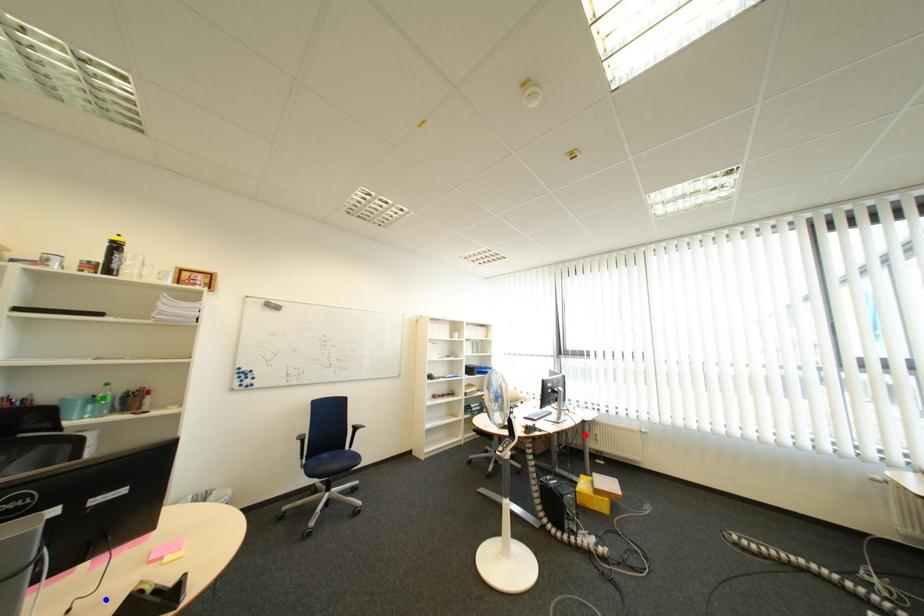
Question: Two points are marked on the image. Which point is closer to the camera?

Choices:
 (A) Blue point is closer.
 (B) Red point is closer.

Answer: (A)